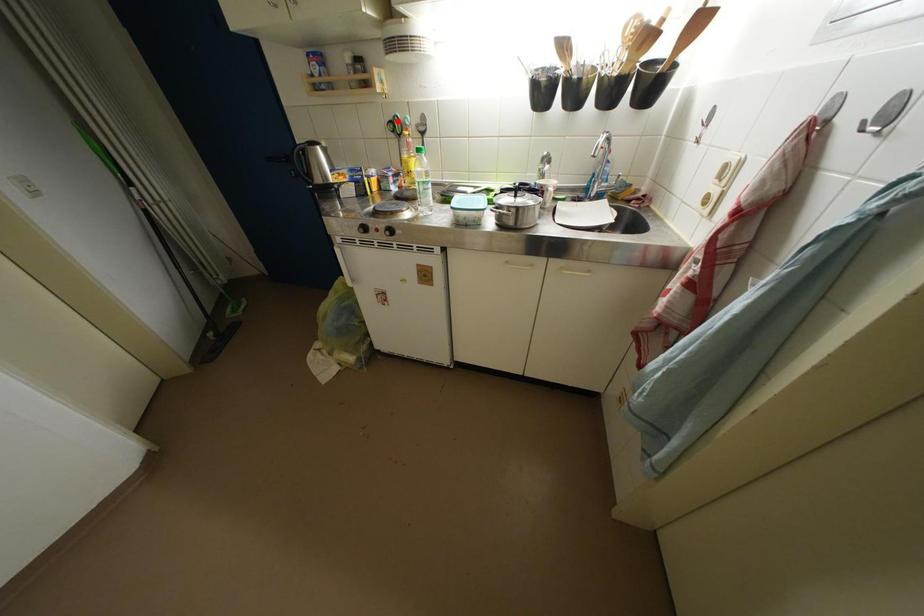
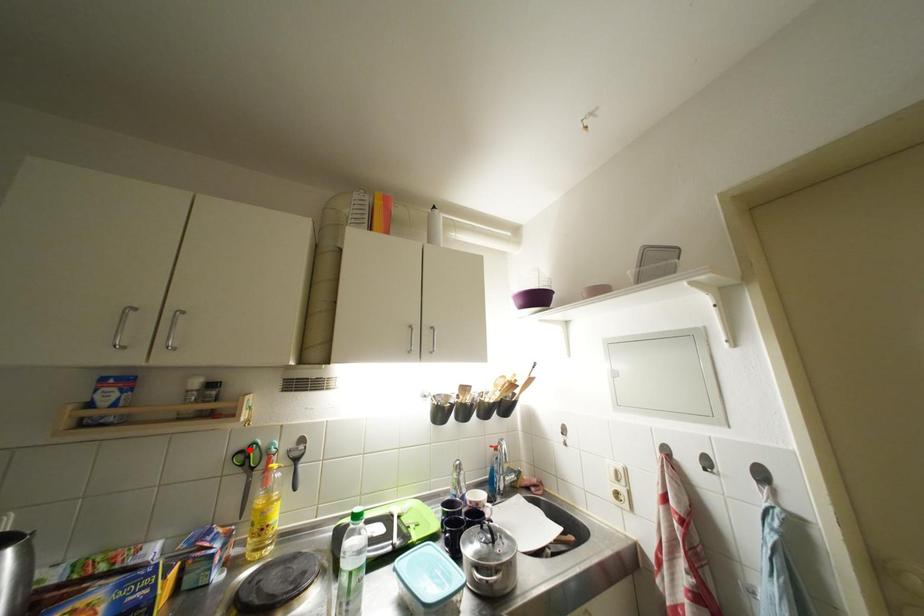
I am providing you with two images of the same scene from different viewpoints. A red point is marked on the first image and another point is marked on the second image. Are the points marked in image1 and image2 representing the same 3D position?

Yes